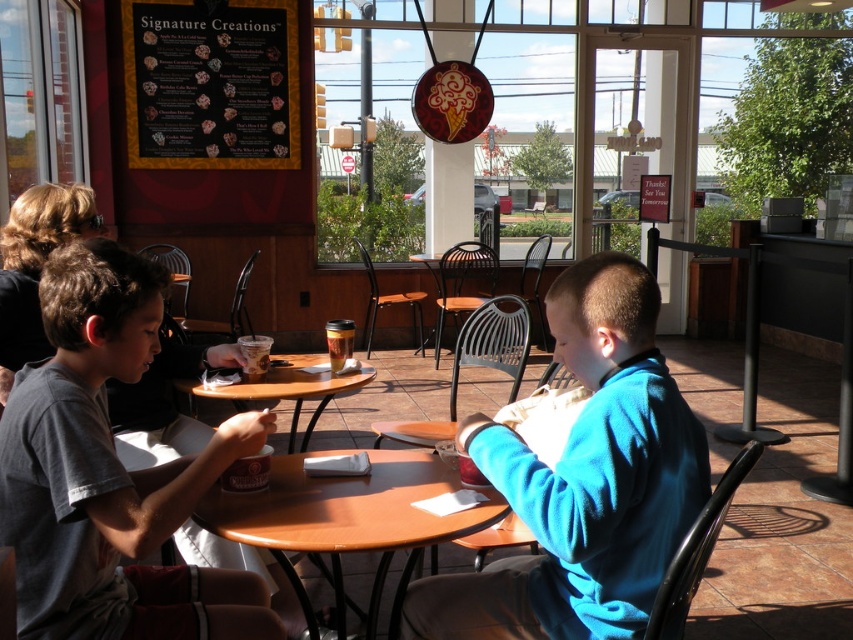
Question: Where is gray cotton shirt at left located in relation to brown paper cup at center in the image?

Choices:
 (A) left
 (B) right

Answer: (A)

Question: Which object is closer to the camera taking this photo?

Choices:
 (A) translucent plastic cup at center
 (B) blue fleece jacket at center
 (C) brown wooden table at center
 (D) gray cotton shirt at left

Answer: (B)

Question: Which of the following is the farthest from the observer?

Choices:
 (A) brown paper cup at center
 (B) blue fleece jacket at center
 (C) translucent plastic cup at center

Answer: (A)

Question: Among these points, which one is nearest to the camera?

Choices:
 (A) (242, 348)
 (B) (613, 561)
 (C) (416, 452)
 (D) (293, 438)

Answer: (B)

Question: Can you confirm if gray cotton shirt at left is smaller than translucent plastic cup at center?

Choices:
 (A) no
 (B) yes

Answer: (A)

Question: Does gray cotton shirt at left appear over wooden table at center?

Choices:
 (A) no
 (B) yes

Answer: (B)